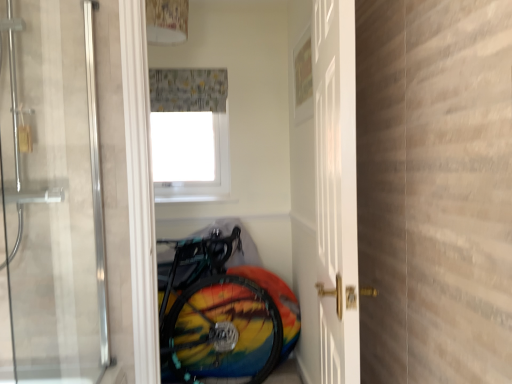
Question: In the image, is white glossy door at center, which is counted as the second door, starting from the left, positioned in front of or behind transparent glass door at center, the second door when ordered from right to left?

Choices:
 (A) behind
 (B) front

Answer: (A)

Question: From a real-world perspective, is white glossy door at center, which is the first door from right to left, physically located above or below transparent glass door at center, the second door when ordered from right to left?

Choices:
 (A) below
 (B) above

Answer: (A)

Question: Which object is the closest to the white matte window screen at upper center?

Choices:
 (A) transparent glass door at center, positioned as the 1th door in left-to-right order
 (B) printed fabric shower curtain at upper center
 (C) rainbow painted tire at lower center
 (D) white glossy door at center, which is counted as the second door, starting from the left

Answer: (B)

Question: Which object is the closest to the printed fabric shower curtain at upper center?

Choices:
 (A) rainbow painted tire at lower center
 (B) white matte window screen at upper center
 (C) transparent glass door at center, the second door when ordered from right to left
 (D) white glossy door at center, which is counted as the second door, starting from the left

Answer: (B)